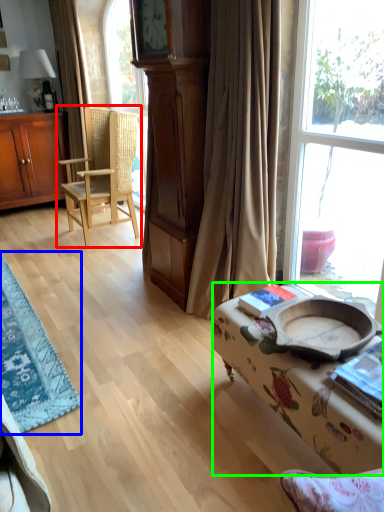
Question: Considering the real-world distances, which object is farthest from chair (highlighted by a red box)? table (highlighted by a blue box) or studio couch (highlighted by a green box)?

Choices:
 (A) table
 (B) studio couch

Answer: (B)